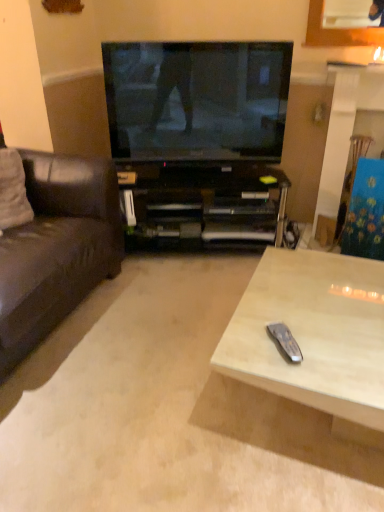
Identify the location of free spot to the left of light wood/texture remote control at lower right. Image resolution: width=384 pixels, height=512 pixels. (145, 392).